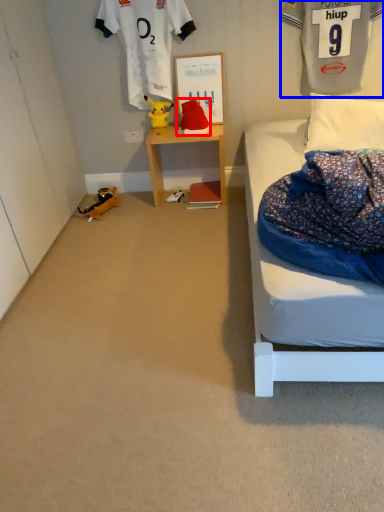
Question: Among these objects, which one is farthest to the camera, toy (highlighted by a red box) or clothing (highlighted by a blue box)?

Choices:
 (A) toy
 (B) clothing

Answer: (A)